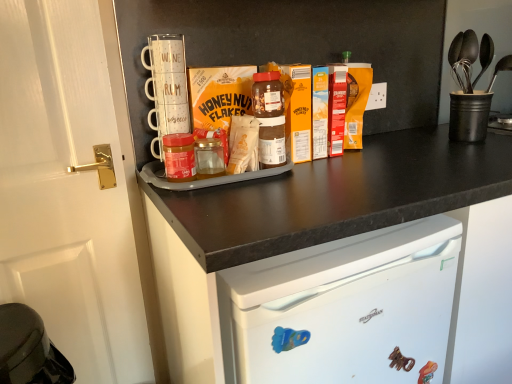
Locate an element on the screen. black matte cabinet at center is located at coordinates (336, 196).

In order to face black matte cup at upper right, should I rotate leftwards or rightwards?

A 25.929 degree turn to the right will do.

This screenshot has width=512, height=384. What are the coordinates of `white glossy door at left` in the screenshot? It's located at (72, 188).

Where is `matte glass jar at center`? matte glass jar at center is located at coordinates (179, 157).

Based on the photo, from a real-world perspective, who is located lower, white glossy door at left or black matte cup at upper right?

white glossy door at left is physically lower.

Which is nearer, (111, 207) or (467, 108)?

Point (111, 207) appears to be closer to the viewer than point (467, 108).

From the image's perspective, is white glossy door at left below black matte cup at upper right?

Yes, from the image's perspective, white glossy door at left is beneath black matte cup at upper right.

Is the depth of white glossy door at left less than that of black matte cup at upper right?

That is True.

From a real-world perspective, between black matte cabinet at center and matte cardboard honey nut flakes at center, who is vertically higher?

matte cardboard honey nut flakes at center.

In the scene shown: Can you confirm if black matte cabinet at center is positioned to the left of matte cardboard honey nut flakes at center?

No.

Is black matte cabinet at center not close to matte cardboard honey nut flakes at center?

No, black matte cabinet at center is not far away from matte cardboard honey nut flakes at center.

Which of these two, black matte cabinet at center or matte cardboard honey nut flakes at center, is thinner?

matte cardboard honey nut flakes at center.

Does point (298, 188) appear closer or farther from the camera than point (170, 140)?

Point (298, 188) is positioned closer to the camera compared to point (170, 140).

From a real-world perspective, who is located lower, black matte cabinet at center or matte glass jar at center?

black matte cabinet at center is physically lower.

From the image's perspective, is black matte cabinet at center on matte glass jar at center?

No.

In terms of size, does black matte cabinet at center appear bigger or smaller than matte glass jar at center?

In the image, black matte cabinet at center appears to be larger than matte glass jar at center.

From a real-world perspective, who is located lower, black matte cup at upper right or matte glass jar at center?

From a 3D spatial view, matte glass jar at center is below.

You are a GUI agent. You are given a task and a screenshot of the screen. Output one action in this format:
    pyautogui.click(x=<x>, y=<y>)
    Task: Click on the appliance behind the matte glass jar at center
    
    Given the screenshot: What is the action you would take?
    pyautogui.click(x=469, y=116)

Are black matte cup at upper right and matte glass jar at center making contact?

No, black matte cup at upper right is not with matte glass jar at center.

Are matte cardboard honey nut flakes at center and black matte cup at upper right far apart?

No, there isn't a large distance between matte cardboard honey nut flakes at center and black matte cup at upper right.

Could you tell me if matte cardboard honey nut flakes at center is facing black matte cup at upper right?

No, matte cardboard honey nut flakes at center is not turned towards black matte cup at upper right.

Which point is more distant from viewer, [253,150] or [488,93]?

The point [488,93] is farther from the camera.

Is white glossy door at left positioned behind black matte cabinet at center?

Yes, white glossy door at left is behind black matte cabinet at center.

Between point (3, 223) and point (373, 199), which one is positioned behind?

Positioned behind is point (3, 223).

In order to click on cabinetry directly beneath the white glossy door at left (from a real-world perspective) in this screenshot , I will do `click(336, 196)`.

From the picture: Is white glossy door at left positioned with its back to black matte cabinet at center?

white glossy door at left does not have its back to black matte cabinet at center.

From a real-world perspective, which is physically below, black matte cup at upper right or black matte cabinet at center?

black matte cabinet at center.

Considering the points (472, 104) and (304, 208), which point is in front, point (472, 104) or point (304, 208)?

The point (304, 208) is more forward.

Which object is positioned more to the left, black matte cup at upper right or black matte cabinet at center?

Positioned to the left is black matte cabinet at center.

Is black matte cup at upper right facing towards black matte cabinet at center?

No, black matte cup at upper right is not aimed at black matte cabinet at center.

At what (x,y) coordinates should I click in order to perform the action: click on appliance above the white glossy door at left (from a real-world perspective). Please return your answer as a coordinate pair (x, y). Image resolution: width=512 pixels, height=384 pixels. Looking at the image, I should click on (469, 116).

At what (x,y) coordinates should I click in order to perform the action: click on cabinetry that appears below the matte cardboard honey nut flakes at center (from the image's perspective). Please return your answer as a coordinate pair (x, y). This screenshot has height=384, width=512. Looking at the image, I should click on (336, 196).

Which object lies nearer to the anchor point matte glass jar at center, matte cardboard honey nut flakes at center or black matte cup at upper right?

matte cardboard honey nut flakes at center is closer to matte glass jar at center.

Which object lies nearer to the anchor point white glossy door at left, matte glass jar at center or matte cardboard honey nut flakes at center?

matte glass jar at center lies closer to white glossy door at left than the other object.

From the image, which object appears to be nearer to black matte cabinet at center, matte cardboard honey nut flakes at center or white glossy door at left?

matte cardboard honey nut flakes at center is positioned closer to the anchor black matte cabinet at center.

Looking at the image, which one is located closer to black matte cabinet at center, black matte cup at upper right or white glossy door at left?

black matte cup at upper right lies closer to black matte cabinet at center than the other object.

When comparing their distances from black matte cabinet at center, does black matte cup at upper right or matte cardboard honey nut flakes at center seem closer?

The object closer to black matte cabinet at center is matte cardboard honey nut flakes at center.

From the image, which object appears to be farther from white glossy door at left, black matte cup at upper right or matte glass jar at center?

Based on the image, black matte cup at upper right appears to be further to white glossy door at left.

Looking at the image, which one is located closer to black matte cup at upper right, matte cardboard honey nut flakes at center or black matte cabinet at center?

Based on the image, black matte cabinet at center appears to be nearer to black matte cup at upper right.

Which object lies further to the anchor point black matte cabinet at center, black matte cup at upper right or matte glass jar at center?

Among the two, black matte cup at upper right is located further to black matte cabinet at center.

In order to click on bottle between white glossy door at left and black matte cabinet at center in the horizontal direction in this screenshot , I will do `click(179, 157)`.

Identify the location of bottle between matte cardboard honey nut flakes at center and black matte cabinet at center from top to bottom. (179, 157).

Identify the location of cereal located between white glossy door at left and black matte cup at upper right in the left-right direction. (243, 144).

The image size is (512, 384). I want to click on cereal between matte glass jar at center and black matte cup at upper right in the horizontal direction, so click(243, 144).